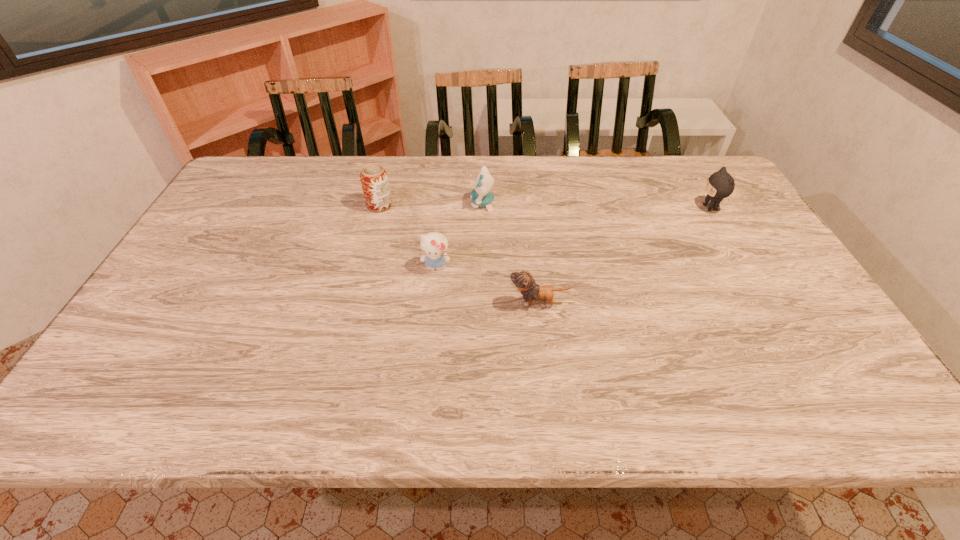
This screenshot has width=960, height=540. What are the coordinates of `vacant space located on the front-facing side of the rightmost object` in the screenshot? It's located at (573, 208).

Locate an element on the screen. Image resolution: width=960 pixels, height=540 pixels. vacant area located on the face of the third object from right to left is located at coordinates (343, 204).

The width and height of the screenshot is (960, 540). Find the location of `vacant space located 0.330m on the face of the third object from right to left`. vacant space located 0.330m on the face of the third object from right to left is located at coordinates (365, 204).

I want to click on vacant space located on the face of the third object from right to left, so click(381, 204).

At what (x,y) coordinates should I click in order to perform the action: click on free spot located on the front-facing side of the second object from left to right. Please return your answer as a coordinate pair (x, y). The height and width of the screenshot is (540, 960). Looking at the image, I should click on (423, 392).

The width and height of the screenshot is (960, 540). I want to click on blank space located 0.340m on the front-facing side of the fourth object from left to right, so click(x=372, y=303).

At what (x,y) coordinates should I click in order to perform the action: click on vacant space located 0.370m on the front-facing side of the fourth object from left to right. Please return your answer as a coordinate pair (x, y). The height and width of the screenshot is (540, 960). Looking at the image, I should click on (360, 303).

Where is `free point located on the front-facing side of the fourth object from left to right`? This screenshot has height=540, width=960. free point located on the front-facing side of the fourth object from left to right is located at coordinates (348, 303).

Locate an element on the screen. object that is at the right edge is located at coordinates (720, 185).

Image resolution: width=960 pixels, height=540 pixels. I want to click on object at the far right corner, so click(720, 185).